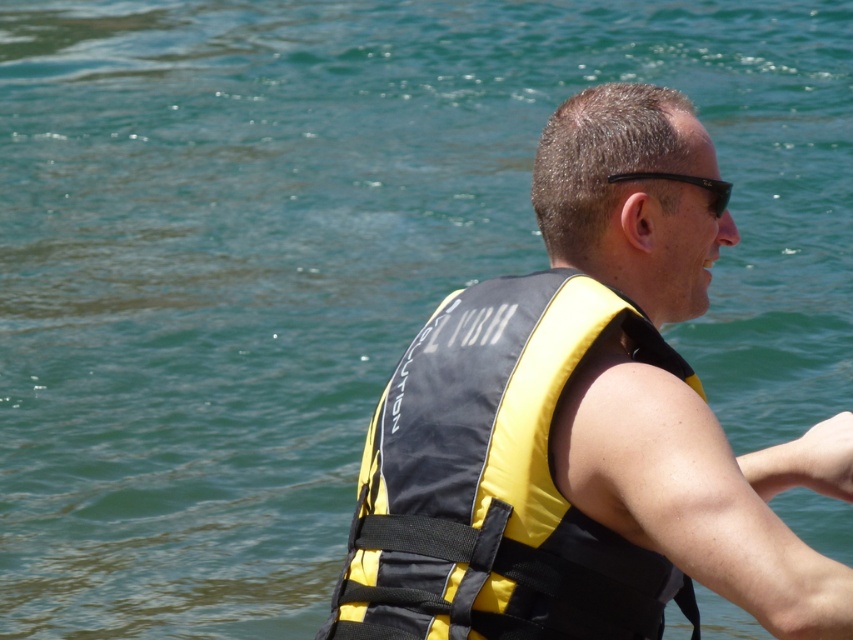
You are a lifeguard on duty and need to retrieve the yellow fabric life jacket at center from the water. Given that your longest reaching tool can extend up to 10 meters, can you safely reach it without entering the water?

The yellow fabric life jacket at center is 10.09 meters away from the viewer. Since your tool can only reach up to 10 meters, it is just slightly out of reach. You would need a longer tool or to move closer to retrieve it safely.

You are a photographer trying to capture a clear shot of the yellow fabric life jacket at center and the black matte sunglasses at upper center. Since you want both items to be visible, which object should you focus on first to ensure proper alignment?

The yellow fabric life jacket at center is positioned on the left side of black matte sunglasses at upper center, so you should focus on the yellow fabric life jacket at center first to ensure proper alignment before adjusting for the black matte sunglasses at upper center.